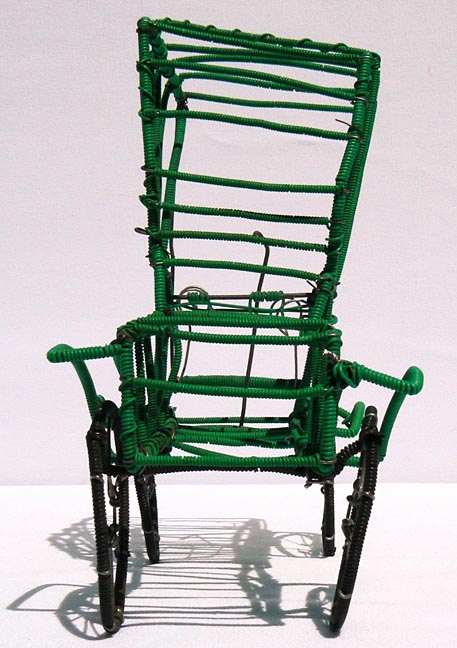
The image size is (457, 648). Identify the location of gray wall midway up on right. (443, 288).